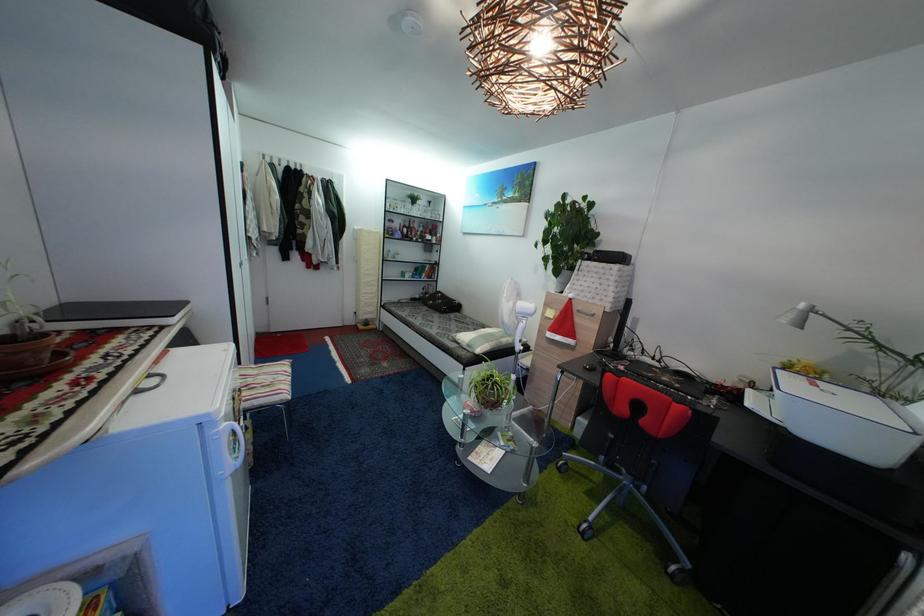
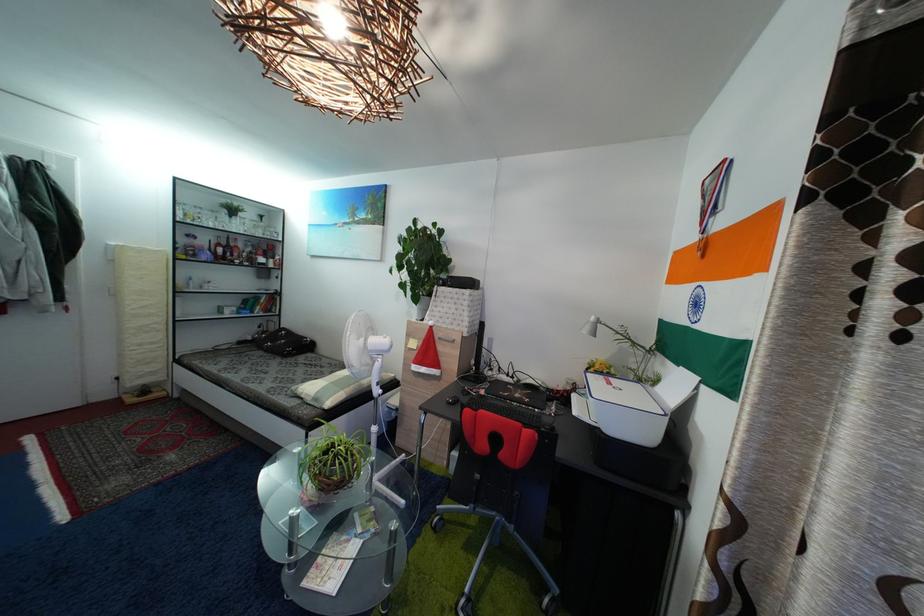
The point at (472, 353) is marked in the first image. Where is the corresponding point in the second image?

(318, 407)